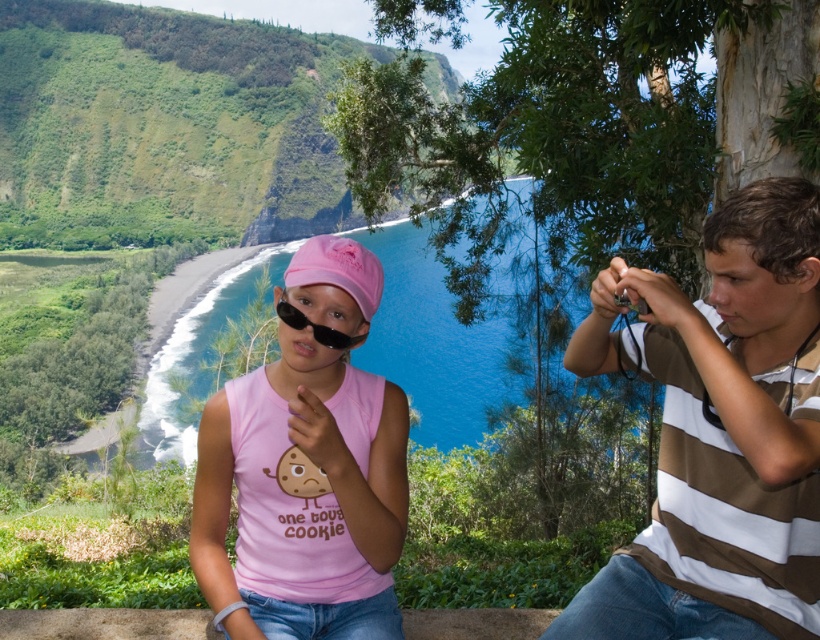
Is brown striped shirt at right thinner than black matte goggles at center?

No, brown striped shirt at right is not thinner than black matte goggles at center.

Is brown striped shirt at right bigger than black matte goggles at center?

Indeed, brown striped shirt at right has a larger size compared to black matte goggles at center.

Is point (780, 234) positioned before point (319, 326)?

That is True.

Where is `brown striped shirt at right`? brown striped shirt at right is located at coordinates (718, 432).

Is pink matte tank top at center to the left of black matte goggles at center from the viewer's perspective?

Incorrect, pink matte tank top at center is not on the left side of black matte goggles at center.

Does pink matte tank top at center have a larger size compared to black matte goggles at center?

Incorrect, pink matte tank top at center is not larger than black matte goggles at center.

The image size is (820, 640). I want to click on pink matte tank top at center, so click(x=306, y=467).

Is pink fabric shirt at center to the left of black matte goggles at center from the viewer's perspective?

Incorrect, pink fabric shirt at center is not on the left side of black matte goggles at center.

Is point (680, 481) positioned before point (299, 317)?

Yes, it is in front of point (299, 317).

In order to click on pink fabric shirt at center in this screenshot , I will do `click(720, 432)`.